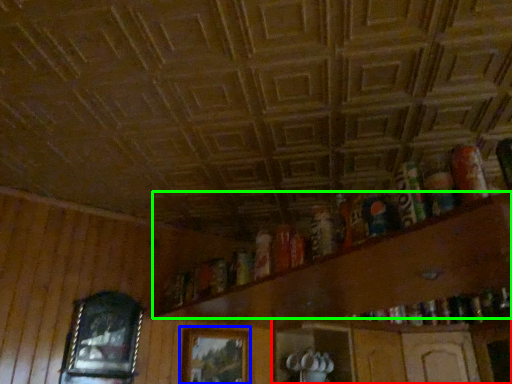
Question: Based on their relative distances, which object is nearer to shelf (highlighted by a red box)? Choose from picture frame (highlighted by a blue box) and shelf (highlighted by a green box).

Choices:
 (A) picture frame
 (B) shelf

Answer: (A)